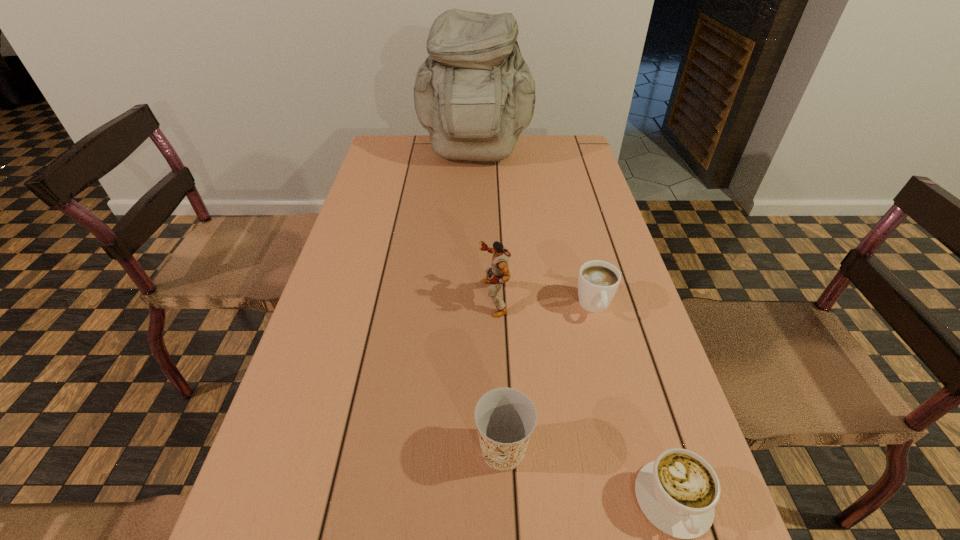
Find the location of a particular element. the tallest object is located at coordinates (475, 94).

At what (x,y) coordinates should I click in order to perform the action: click on the farthest object. Please return your answer as a coordinate pair (x, y). The width and height of the screenshot is (960, 540). Looking at the image, I should click on (475, 94).

Find the location of a particular element. This screenshot has width=960, height=540. puncher is located at coordinates (499, 273).

Where is `Dixie cup`? Image resolution: width=960 pixels, height=540 pixels. Dixie cup is located at coordinates (505, 417).

This screenshot has width=960, height=540. Identify the location of the fourth tallest object. (598, 281).

Where is `the farther cappuccino`? This screenshot has height=540, width=960. the farther cappuccino is located at coordinates (598, 281).

Where is `free space located on the front-facing side of the farthest object`? free space located on the front-facing side of the farthest object is located at coordinates (474, 206).

This screenshot has height=540, width=960. I want to click on free space located 0.050m on the front-facing side of the puncher, so click(458, 298).

I want to click on free space located 0.120m on the front-facing side of the puncher, so click(428, 298).

I want to click on vacant space located 0.320m on the front-facing side of the puncher, so click(x=343, y=298).